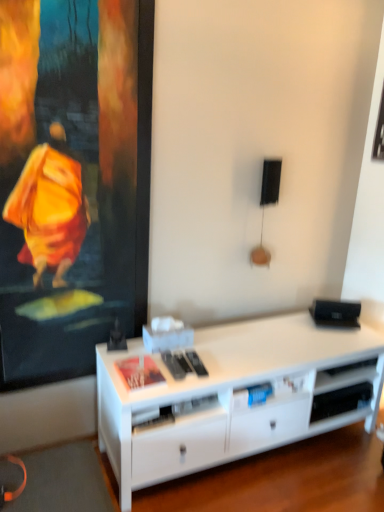
Question: Is point (145, 391) closer or farther from the camera than point (360, 379)?

Choices:
 (A) closer
 (B) farther

Answer: (A)

Question: Is white matte desk at center wider or thinner than white matte shelf at lower right?

Choices:
 (A) thin
 (B) wide

Answer: (B)

Question: From a real-world perspective, is white matte desk at center physically located above or below white matte shelf at lower right?

Choices:
 (A) below
 (B) above

Answer: (B)

Question: Considering the positions of white matte shelf at lower right and white matte desk at center in the image, is white matte shelf at lower right bigger or smaller than white matte desk at center?

Choices:
 (A) small
 (B) big

Answer: (A)

Question: In the image, is white matte shelf at lower right positioned in front of or behind white matte desk at center?

Choices:
 (A) front
 (B) behind

Answer: (B)

Question: Is white matte shelf at lower right to the left or to the right of white matte desk at center in the image?

Choices:
 (A) left
 (B) right

Answer: (B)

Question: Which is correct: white matte shelf at lower right is inside white matte desk at center, or outside of it?

Choices:
 (A) outside
 (B) inside

Answer: (B)